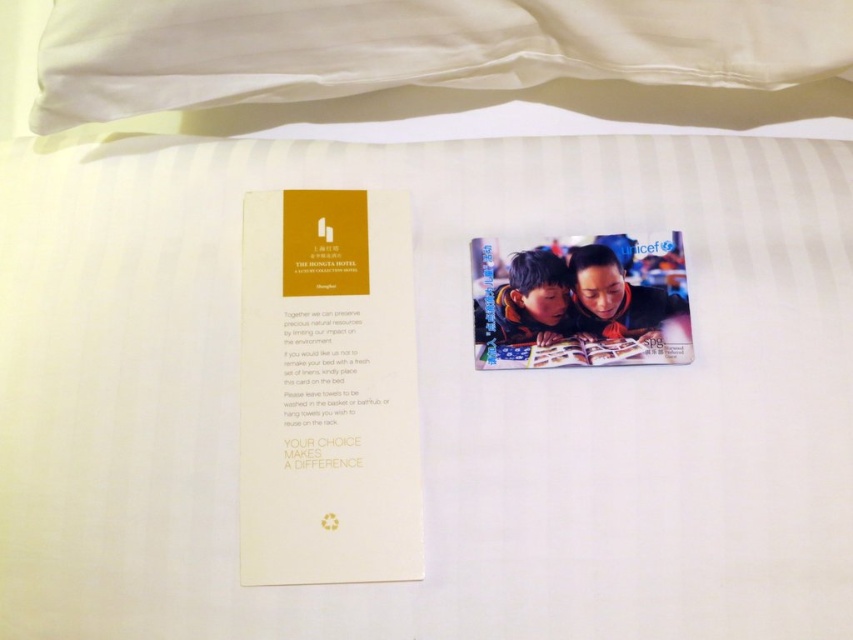
You are a guest staying at the Hongta Hotel and see the gold paper card at left and the matte plastic magazine at center on your bed. The hotel staff asks you to place them in order from left to right. Which item should be placed first on the left side?

The gold paper card at left should be placed first on the left side since it is already positioned to the left of the matte plastic magazine at center.

You are a guest at the Hongta Hotel and see the gold paper card at left and the matte plastic magazine at center on your bed. The hotel staff asks you to pick up the item that is closer to you. Which item should you choose?

The gold paper card at left is in front of the matte plastic magazine at center, so it is closer to you. You should pick up the gold paper card at left.